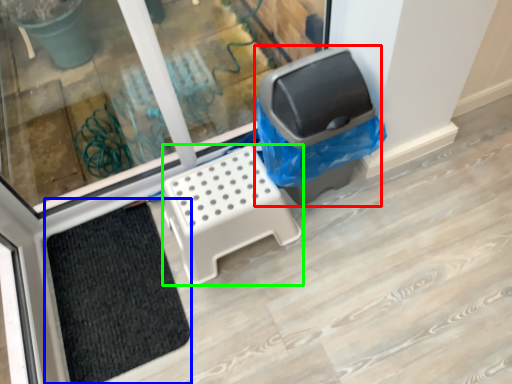
Question: Estimate the real-world distances between objects in this image. Which object is farther from recycling bin (highlighted by a red box), doormat (highlighted by a blue box) or furniture (highlighted by a green box)?

Choices:
 (A) doormat
 (B) furniture

Answer: (A)